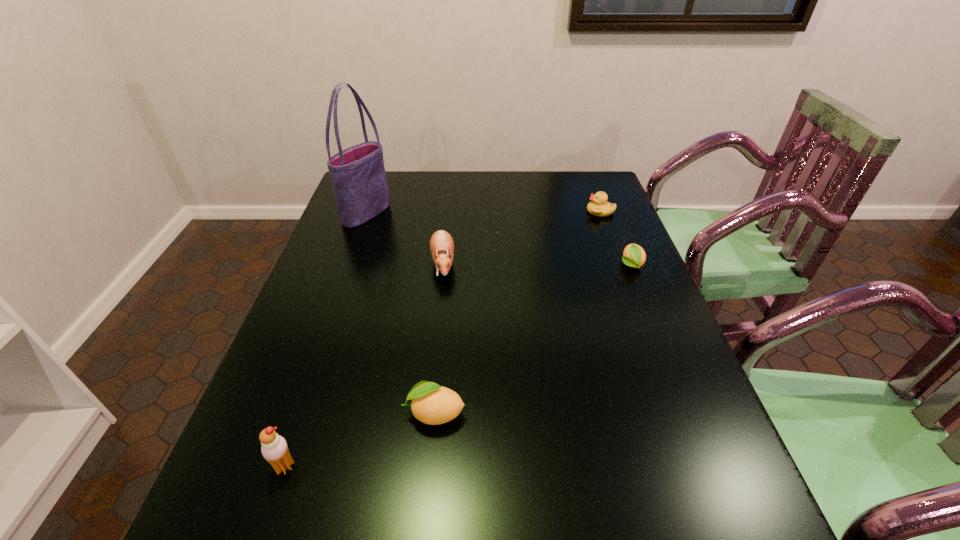
Find the location of a particular element. object that is at the near edge is located at coordinates (274, 449).

Find the location of `tote bag positioned at the left edge`. tote bag positioned at the left edge is located at coordinates (358, 176).

You are a GUI agent. You are given a task and a screenshot of the screen. Output one action in this format:
    pyautogui.click(x=<x>, y=<y>)
    Task: Click on the icecream present at the left edge
    The height and width of the screenshot is (540, 960).
    Given the screenshot: What is the action you would take?
    pyautogui.click(x=274, y=449)

Locate an element on the screen. The image size is (960, 540). lemon that is at the right edge is located at coordinates (634, 256).

Locate an element on the screen. duckling at the right edge is located at coordinates (598, 206).

At what (x,y) coordinates should I click in order to perform the action: click on object at the far left corner. Please return your answer as a coordinate pair (x, y). This screenshot has width=960, height=540. Looking at the image, I should click on 358,176.

Find the location of a particular element. The width and height of the screenshot is (960, 540). object at the near left corner is located at coordinates (274, 449).

Where is `object that is at the far right corner`? Image resolution: width=960 pixels, height=540 pixels. object that is at the far right corner is located at coordinates (598, 206).

The height and width of the screenshot is (540, 960). Find the location of `free space at the far edge of the desktop`. free space at the far edge of the desktop is located at coordinates (394, 204).

Image resolution: width=960 pixels, height=540 pixels. I want to click on vacant space at the near edge of the desktop, so click(389, 453).